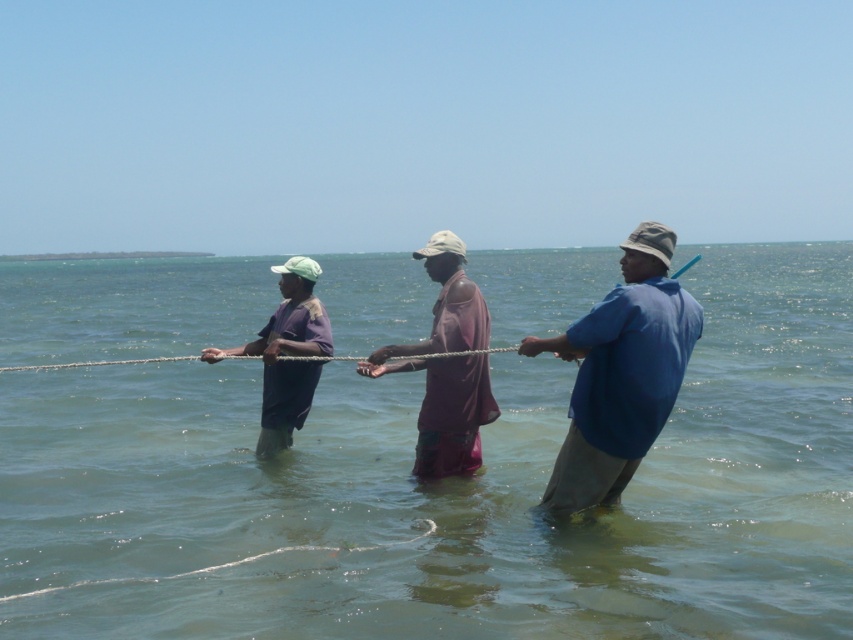
Which is more to the right, clear water at center or blue cotton shirt at right?

From the viewer's perspective, blue cotton shirt at right appears more on the right side.

Is point (7, 538) positioned behind point (656, 307)?

Yes, it is behind point (656, 307).

You are a GUI agent. You are given a task and a screenshot of the screen. Output one action in this format:
    pyautogui.click(x=<x>, y=<y>)
    Task: Click on the clear water at center
    This screenshot has width=853, height=640.
    Given the screenshot: What is the action you would take?
    pyautogui.click(x=445, y=492)

Who is shorter, blue cotton shirt at right or purple cotton shirt at left?

With less height is blue cotton shirt at right.

Is blue cotton shirt at right to the right of purple cotton shirt at left from the viewer's perspective?

Yes, blue cotton shirt at right is to the right of purple cotton shirt at left.

What do you see at coordinates (621, 372) in the screenshot? The height and width of the screenshot is (640, 853). I see `blue cotton shirt at right` at bounding box center [621, 372].

The image size is (853, 640). Find the location of `blue cotton shirt at right`. blue cotton shirt at right is located at coordinates (621, 372).

Does blue fabric shirt at center have a lesser width compared to blue cotton shirt at right?

No.

What do you see at coordinates (621, 372) in the screenshot?
I see `blue fabric shirt at center` at bounding box center [621, 372].

What are the coordinates of `blue fabric shirt at center` in the screenshot? It's located at (621, 372).